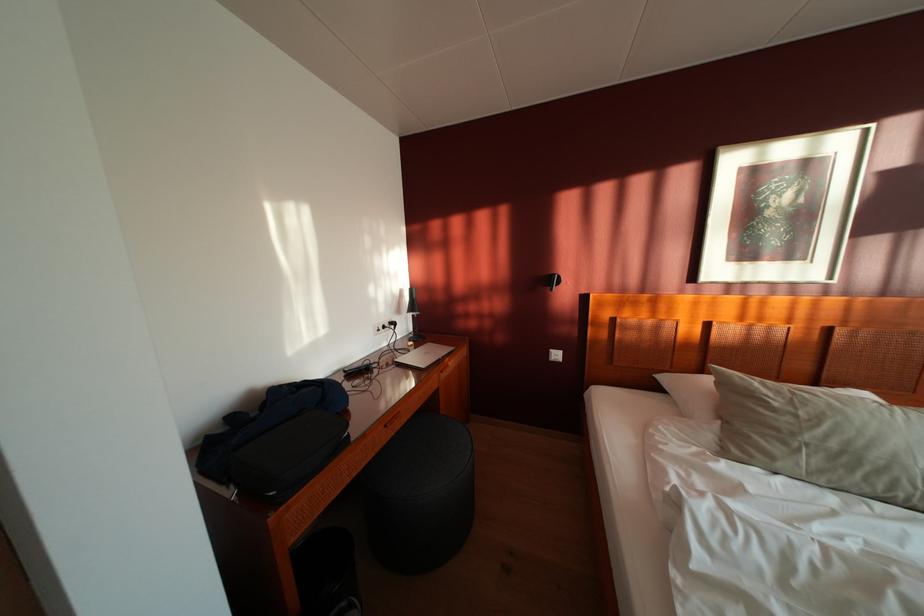
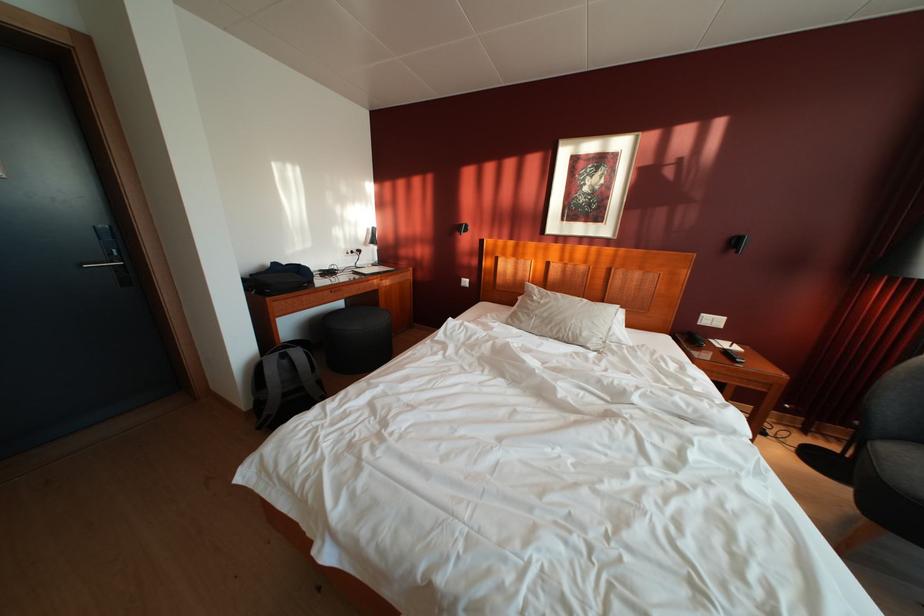
Locate, in the second image, the point that corresponds to the point at 419,334 in the first image.

(384, 265)